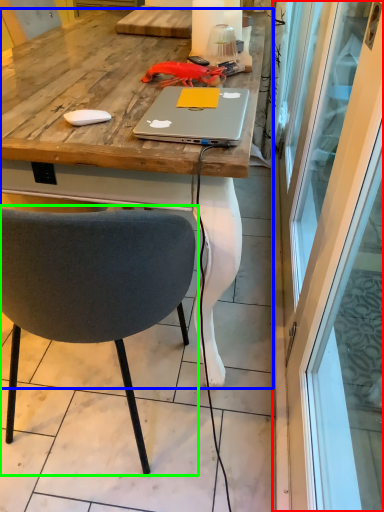
Question: Which object is the farthest from screen door (highlighted by a red box)? Choose among these: desk (highlighted by a blue box) or chair (highlighted by a green box).

Choices:
 (A) desk
 (B) chair

Answer: (B)